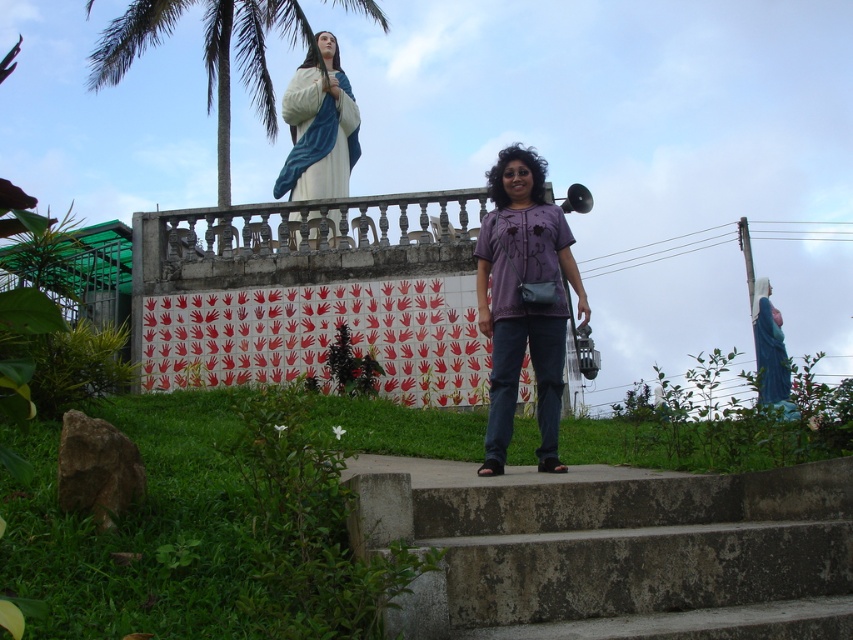
What is the exact location of the purple cotton shirt at center in the image?

The purple cotton shirt at center is located at point (523, 300).

You are a photographer standing at the base of the steps. You want to take a photo of the purple cotton shirt at center and the matte white statue at upper center so that both are clearly visible in the frame. Given their distance apart, will you need to use a wide angle lens or a telephoto lens?

The purple cotton shirt at center is 40.74 meters from the matte white statue at upper center. Since they are far apart, you will need to use a wide angle lens to capture both in the frame.

You are a photographer trying to capture a photo of the purple cotton shirt at center and the green leafy palm tree at upper left. Which object appears narrower in the photo?

The purple cotton shirt at center appears narrower than the green leafy palm tree at upper left in the photo.